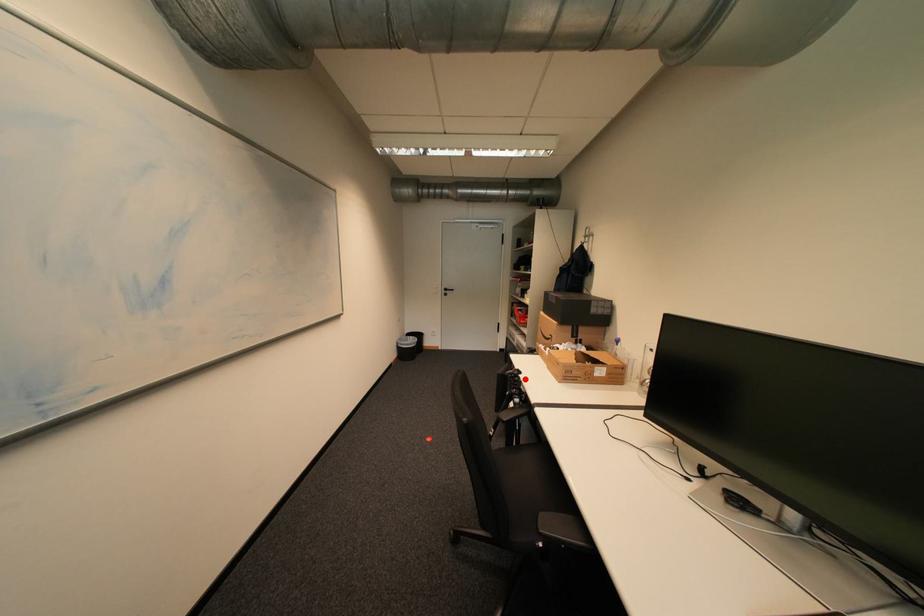
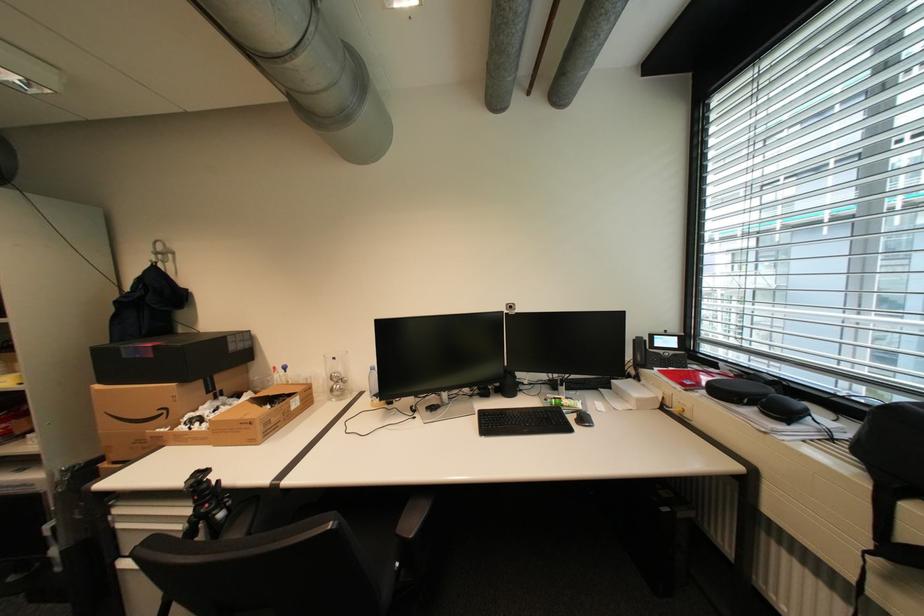
Question: A red point is marked in image1. In image2, is the corresponding 3D point closer to the camera or farther? Reply with the corresponding letter.

Choices:
 (A) The corresponding 3D point is closer.
 (B) The corresponding 3D point is farther.

Answer: (B)